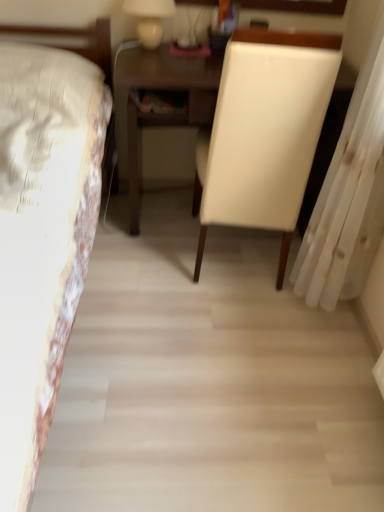
Question: From the image's perspective, is white leather chair at center located above or below white sheer curtain at right?

Choices:
 (A) below
 (B) above

Answer: (B)

Question: Is white leather chair at center bigger or smaller than white sheer curtain at right?

Choices:
 (A) big
 (B) small

Answer: (A)

Question: Which of these objects is positioned farthest from the white floral fabric bed at left?

Choices:
 (A) white leather chair at center
 (B) white sheer curtain at right
 (C) matte white lamp at upper center

Answer: (B)

Question: Which object is the closest to the white floral fabric bed at left?

Choices:
 (A) white sheer curtain at right
 (B) white leather chair at center
 (C) matte white lamp at upper center

Answer: (B)